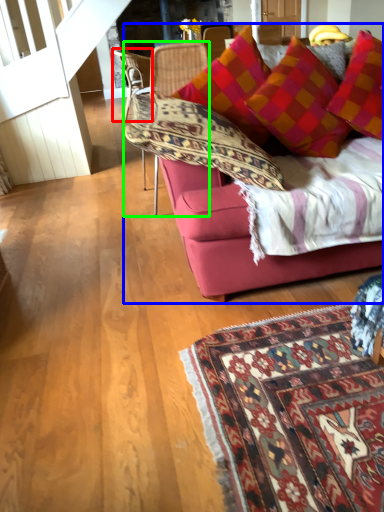
Question: Which object is the farthest from chair (highlighted by a red box)? Choose among these: studio couch (highlighted by a blue box) or chair (highlighted by a green box).

Choices:
 (A) studio couch
 (B) chair

Answer: (A)